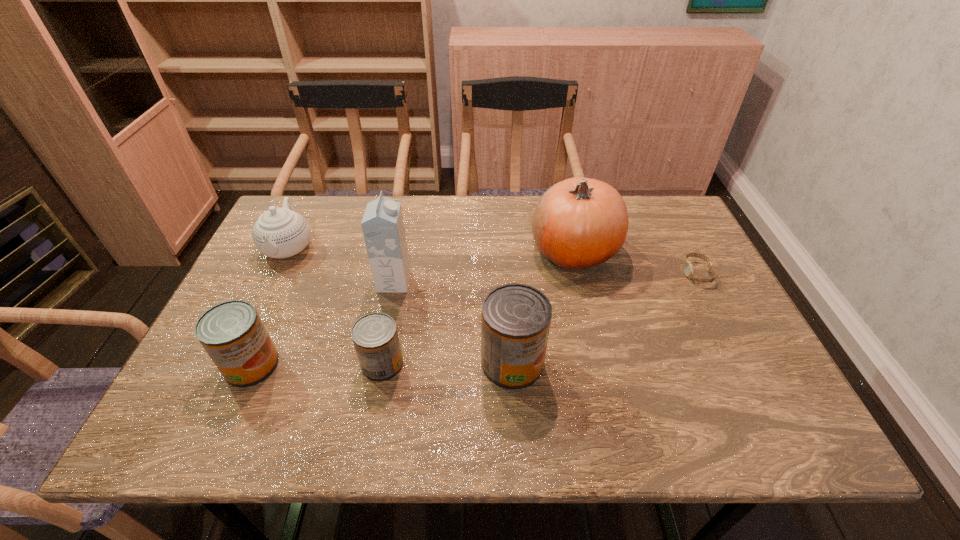
This screenshot has height=540, width=960. I want to click on vacant space that satisfies the following two spatial constraints: 1. on the front label of the carton; 2. on the left side of the shortest can, so click(377, 364).